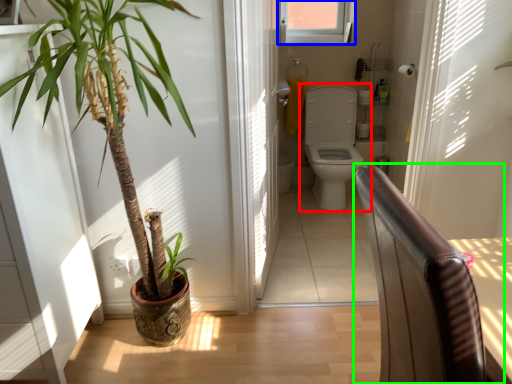
Question: Which is nearer to the toilet (highlighted by a red box)? window (highlighted by a blue box) or chair (highlighted by a green box).

Choices:
 (A) window
 (B) chair

Answer: (A)